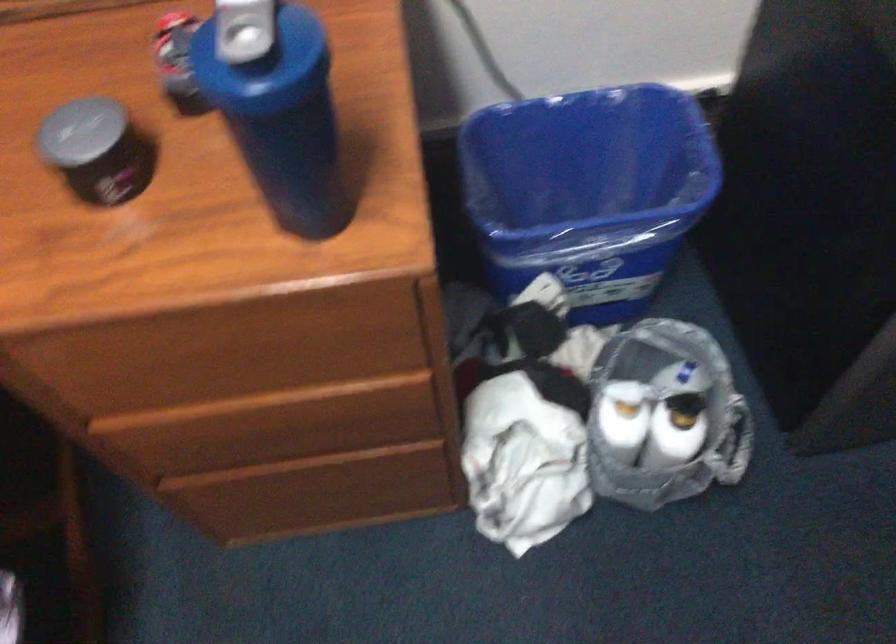
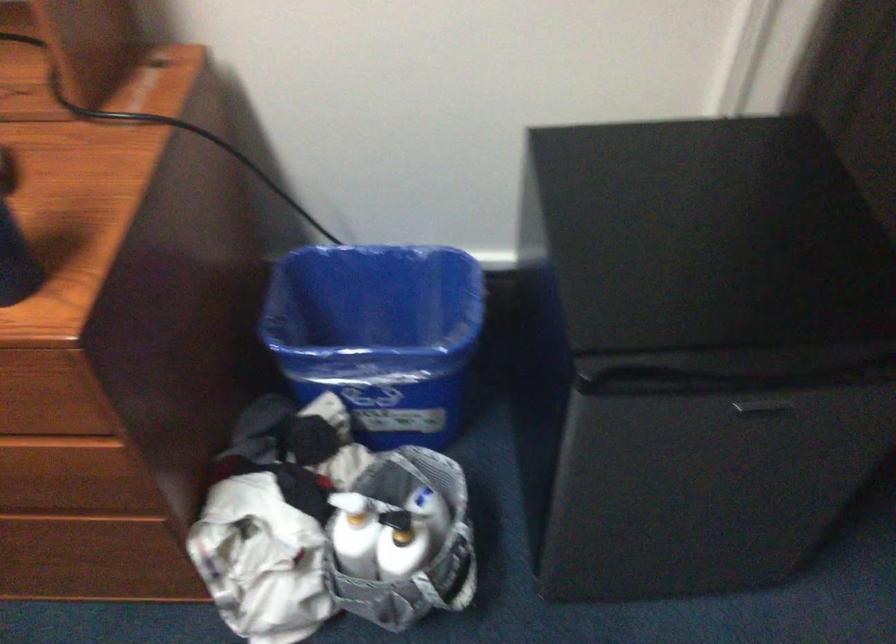
The point at (625, 422) is marked in the first image. Where is the corresponding point in the second image?

(354, 534)